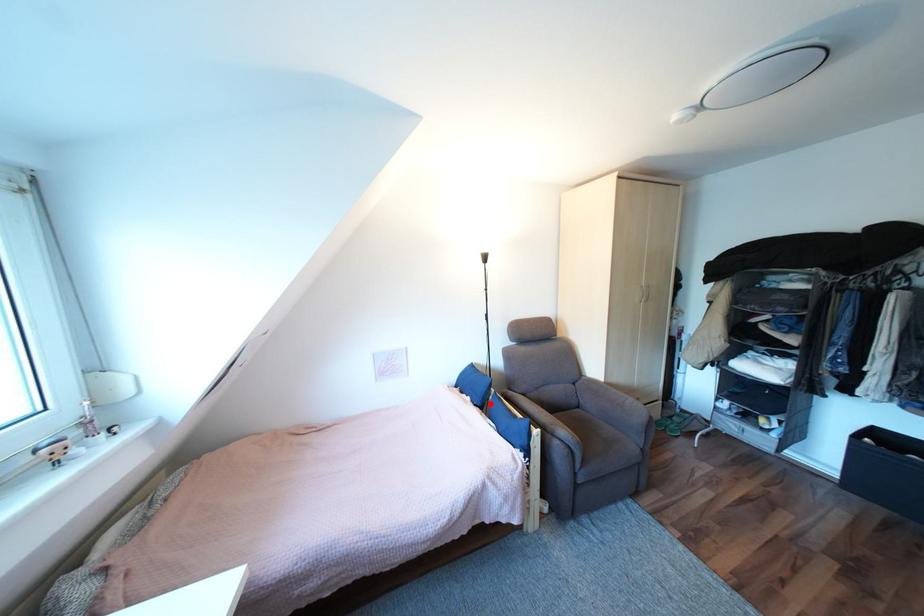
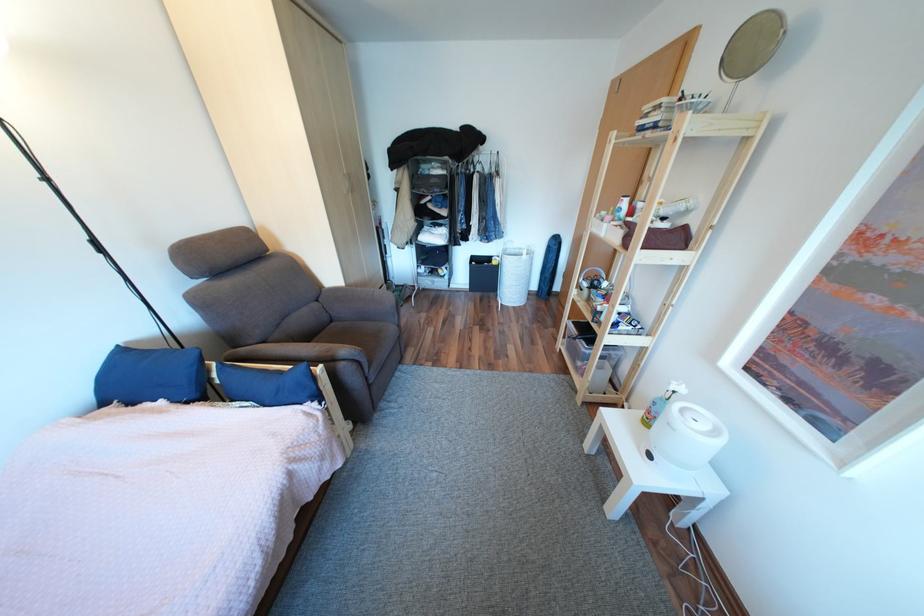
Question: I am providing you with two images of the same scene from different viewpoints. In image1, a red point is highlighted. Considering the same 3D point in image2, which of the following is correct?

Choices:
 (A) It is closer
 (B) It is farther

Answer: (B)